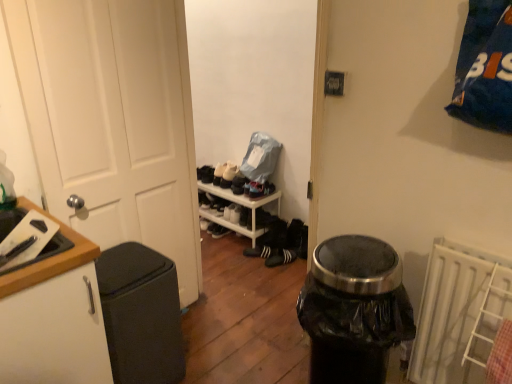
Question: From the image's perspective, is black suede sneakers at center, the first footwear from the right, above black plastic trash can at center?

Choices:
 (A) no
 (B) yes

Answer: (B)

Question: Is there a large distance between black suede sneakers at center, the first footwear from the right, and black plastic trash can at center?

Choices:
 (A) yes
 (B) no

Answer: (A)

Question: Can you confirm if black suede sneakers at center, the first footwear from the right, is bigger than black plastic trash can at center?

Choices:
 (A) yes
 (B) no

Answer: (B)

Question: Can you confirm if black suede sneakers at center, which is the 2th footwear in left-to-right order, is shorter than black plastic trash can at center?

Choices:
 (A) yes
 (B) no

Answer: (A)

Question: Is black suede sneakers at center, which is the 2th footwear in left-to-right order, next to black plastic trash can at center and touching it?

Choices:
 (A) yes
 (B) no

Answer: (B)

Question: Can you confirm if black suede sneakers at center, the first footwear from the right, is positioned to the left of black plastic trash can at center?

Choices:
 (A) no
 (B) yes

Answer: (B)

Question: Is wooden cutting board at left positioned far away from white matte door at left?

Choices:
 (A) yes
 (B) no

Answer: (B)

Question: Are wooden cutting board at left and white matte door at left beside each other?

Choices:
 (A) no
 (B) yes

Answer: (A)

Question: Can you confirm if wooden cutting board at left is shorter than white matte door at left?

Choices:
 (A) no
 (B) yes

Answer: (B)

Question: Is wooden cutting board at left positioned with its back to white matte door at left?

Choices:
 (A) yes
 (B) no

Answer: (B)

Question: Considering the relative positions of wooden cutting board at left and white matte door at left in the image provided, is wooden cutting board at left behind white matte door at left?

Choices:
 (A) no
 (B) yes

Answer: (A)

Question: Considering the relative positions of wooden cutting board at left and white matte door at left in the image provided, is wooden cutting board at left to the left of white matte door at left from the viewer's perspective?

Choices:
 (A) no
 (B) yes

Answer: (B)

Question: Is white matte cabinet at left not within white plastic radiator at lower right?

Choices:
 (A) no
 (B) yes

Answer: (B)